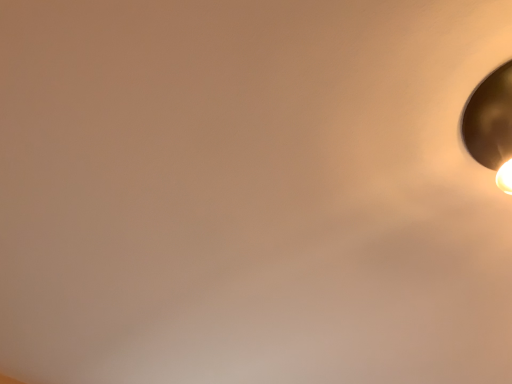
What do you see at coordinates (490, 124) in the screenshot? This screenshot has height=384, width=512. I see `metallic gold lampshade at upper right` at bounding box center [490, 124].

You are a GUI agent. You are given a task and a screenshot of the screen. Output one action in this format:
    pyautogui.click(x=<x>, y=<y>)
    Task: Click on the metallic gold lampshade at upper right
    The image size is (512, 384).
    Given the screenshot: What is the action you would take?
    (490, 124)

Where is `metallic gold lampshade at upper right`? metallic gold lampshade at upper right is located at coordinates (490, 124).